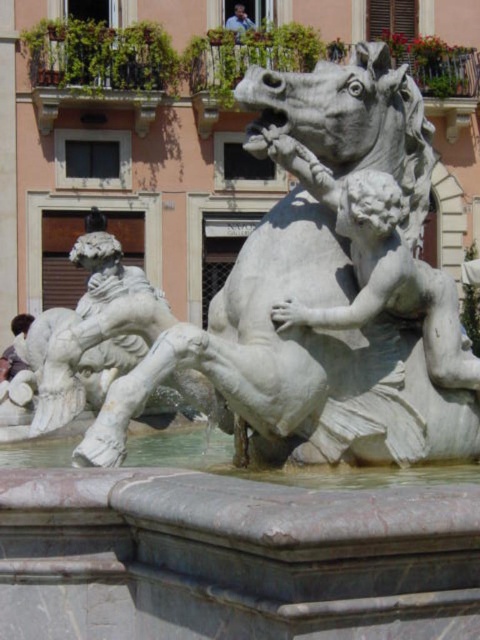
You are standing at the center of the fountain and want to move towards the point closer to you. Which point should you head towards, point (408, 204) or point (236, 22)?

Point (236, 22) is closer to you because it is behind point (408, 204), so you should head towards point (408, 204).

You are standing at the point with coordinates point (300, 358) in the fountain scene. What object are you standing on?

You are standing on the white marble horse at center.